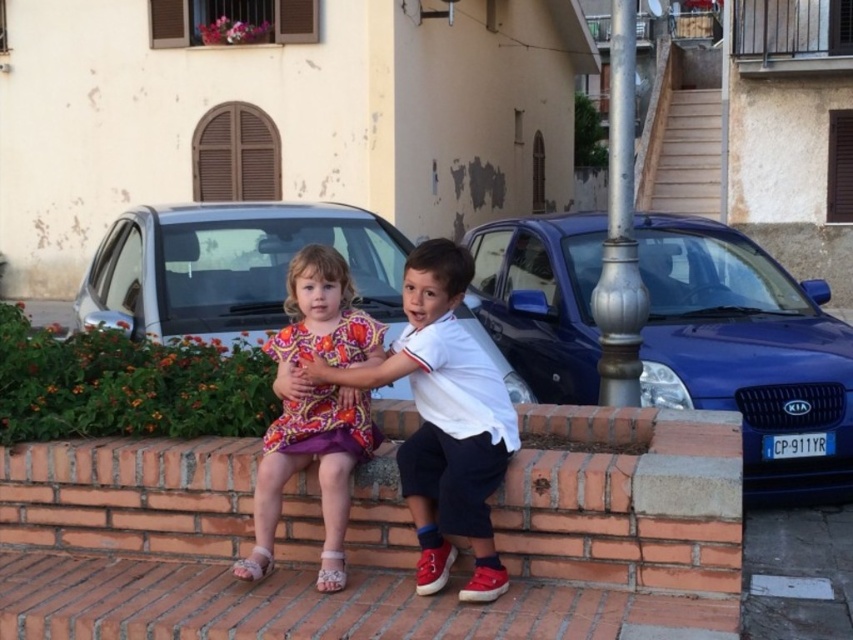
You are a delivery person trying to deliver a package to the white cotton shirt at center. The blue metallic car at right is blocking the path. Can you walk around the car to reach the person?

The blue metallic car at right and white cotton shirt at center are 2.92 meters apart from each other. Since the car is blocking the path, you can walk around it as long as there is enough space. However, the distance between them does not indicate the available space around the car. You might need to check the surroundings for an alternative route.

You are a photographer trying to capture a photo of the silver metallic car at center and the printed fabric dress at center. Since you want both objects in the frame, where should you position yourself relative to the two objects?

You should position yourself to the right of both the silver metallic car at center and the printed fabric dress at center so that the car is on the left and the dress is on the right in the photo.